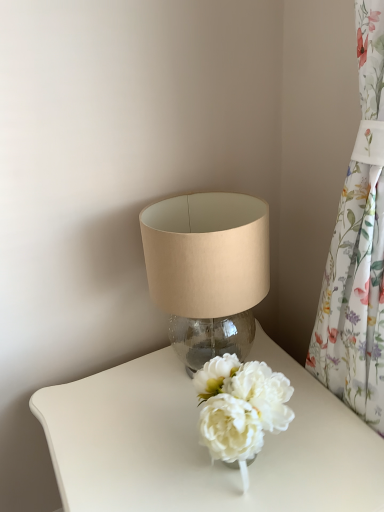
Describe the element at coordinates (208, 270) in the screenshot. I see `translucent glass lampshade at upper center` at that location.

The width and height of the screenshot is (384, 512). I want to click on white glossy table at center, so click(x=202, y=446).

Considering the sizes of objects translucent glass lampshade at upper center and floral fabric curtain at right in the image provided, who is wider, translucent glass lampshade at upper center or floral fabric curtain at right?

translucent glass lampshade at upper center is wider.

Does translucent glass lampshade at upper center have a smaller size compared to floral fabric curtain at right?

Indeed, translucent glass lampshade at upper center has a smaller size compared to floral fabric curtain at right.

Can you tell me how much translucent glass lampshade at upper center and floral fabric curtain at right differ in facing direction?

3.09 degrees.

Considering the positions of objects translucent glass lampshade at upper center and floral fabric curtain at right in the image provided, who is more to the left, translucent glass lampshade at upper center or floral fabric curtain at right?

From the viewer's perspective, translucent glass lampshade at upper center appears more on the left side.

Considering the relative positions of white glossy table at center and floral fabric curtain at right in the image provided, is white glossy table at center in front of floral fabric curtain at right?

That is False.

Is white glossy table at center next to floral fabric curtain at right and touching it?

There is a gap between white glossy table at center and floral fabric curtain at right.

From a real-world perspective, which is physically below, white glossy table at center or floral fabric curtain at right?

From a 3D spatial view, white glossy table at center is below.

How distant is white glossy table at center from floral fabric curtain at right?

white glossy table at center is 31.66 centimeters away from floral fabric curtain at right.

Looking at this image, are translucent glass lampshade at upper center and white glossy table at center beside each other?

No, translucent glass lampshade at upper center is not making contact with white glossy table at center.

Considering the relative positions of translucent glass lampshade at upper center and white glossy table at center in the image provided, is translucent glass lampshade at upper center behind white glossy table at center?

Yes, it is.

Are floral fabric curtain at right and translucent glass lampshade at upper center located far from each other?

floral fabric curtain at right is actually quite close to translucent glass lampshade at upper center.

Which point is more distant from viewer, (367, 278) or (199, 244)?

Positioned behind is point (199, 244).

From the image's perspective, would you say floral fabric curtain at right is positioned over translucent glass lampshade at upper center?

No, from the image's perspective, floral fabric curtain at right is not above translucent glass lampshade at upper center.

Is white glossy table at center oriented away from translucent glass lampshade at upper center?

No, translucent glass lampshade at upper center is not at the back of white glossy table at center.

Would you say translucent glass lampshade at upper center is part of white glossy table at center's contents?

That's incorrect, translucent glass lampshade at upper center is not inside white glossy table at center.

Can you confirm if white glossy table at center is positioned to the left of translucent glass lampshade at upper center?

No.

Between white glossy table at center and translucent glass lampshade at upper center, which one has smaller size?

translucent glass lampshade at upper center is smaller.

Which of these two, floral fabric curtain at right or white glossy table at center, is wider?

With larger width is white glossy table at center.

Would you say floral fabric curtain at right is inside or outside white glossy table at center?

floral fabric curtain at right lies outside white glossy table at center.

From a real-world perspective, is floral fabric curtain at right positioned above or below white glossy table at center?

From a real-world perspective, floral fabric curtain at right is physically above white glossy table at center.

Between floral fabric curtain at right and white glossy table at center, which one is positioned in front?

floral fabric curtain at right.

The height and width of the screenshot is (512, 384). Find the location of `lamp to the left of floral fabric curtain at right`. lamp to the left of floral fabric curtain at right is located at coordinates (208, 270).

Identify the location of table behind the floral fabric curtain at right. This screenshot has height=512, width=384. (202, 446).

Considering their positions, is floral fabric curtain at right positioned closer to white glossy table at center than translucent glass lampshade at upper center?

The object closer to white glossy table at center is translucent glass lampshade at upper center.

Considering their positions, is translucent glass lampshade at upper center positioned closer to white glossy table at center than floral fabric curtain at right?

Among the two, translucent glass lampshade at upper center is located nearer to white glossy table at center.

Looking at this image, estimate the real-world distances between objects in this image. Which object is closer to translucent glass lampshade at upper center, floral fabric curtain at right or white glossy table at center?

white glossy table at center.

Estimate the real-world distances between objects in this image. Which object is further from floral fabric curtain at right, white glossy table at center or translucent glass lampshade at upper center?

white glossy table at center.

Looking at the image, which one is located closer to floral fabric curtain at right, translucent glass lampshade at upper center or white glossy table at center?

translucent glass lampshade at upper center lies closer to floral fabric curtain at right than the other object.

Based on their spatial positions, is white glossy table at center or floral fabric curtain at right further from translucent glass lampshade at upper center?

floral fabric curtain at right is positioned further to the anchor translucent glass lampshade at upper center.

Where is `curtain between translucent glass lampshade at upper center and white glossy table at center in the vertical direction`? This screenshot has height=512, width=384. curtain between translucent glass lampshade at upper center and white glossy table at center in the vertical direction is located at coordinates (358, 249).